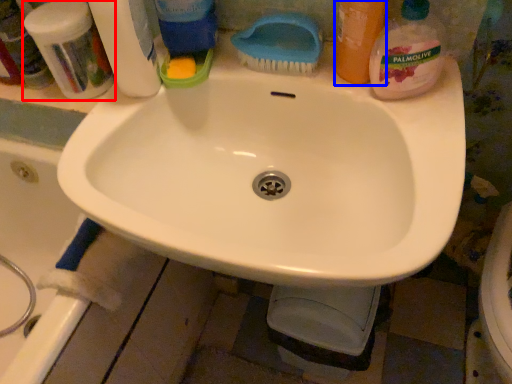
Question: Which object is further to the camera taking this photo, toiletry (highlighted by a red box) or cleaning product (highlighted by a blue box)?

Choices:
 (A) toiletry
 (B) cleaning product

Answer: (A)